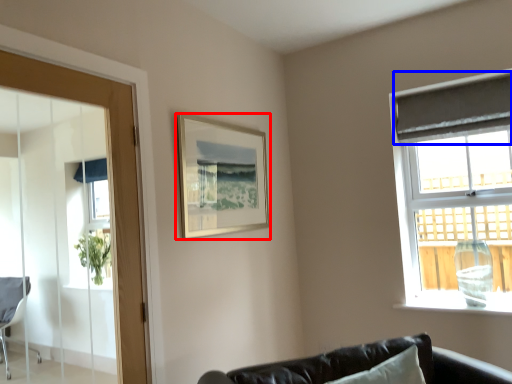
Question: Among these objects, which one is farthest to the camera, picture frame (highlighted by a red box) or curtain (highlighted by a blue box)?

Choices:
 (A) picture frame
 (B) curtain

Answer: (B)